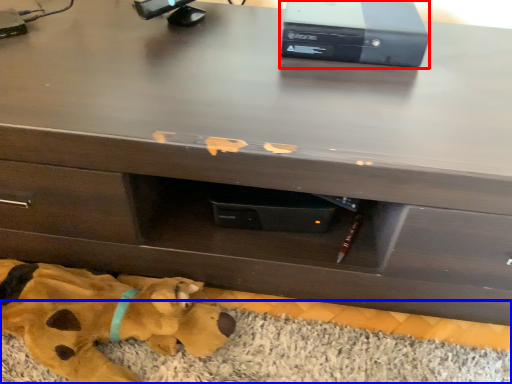
Question: Which object is further to the camera taking this photo, computer (highlighted by a red box) or mat (highlighted by a blue box)?

Choices:
 (A) computer
 (B) mat

Answer: (A)